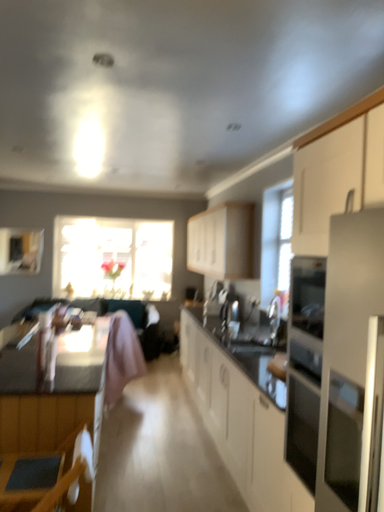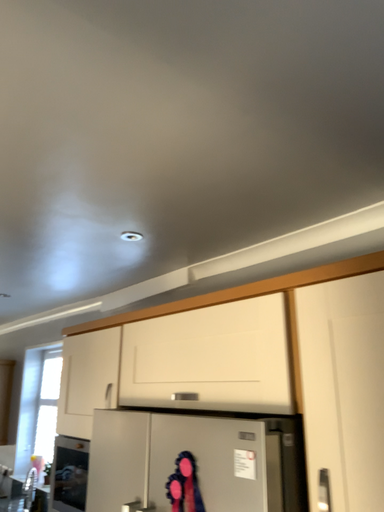
Question: How did the camera likely rotate when shooting the video?

Choices:
 (A) rotated downward
 (B) rotated upward

Answer: (B)